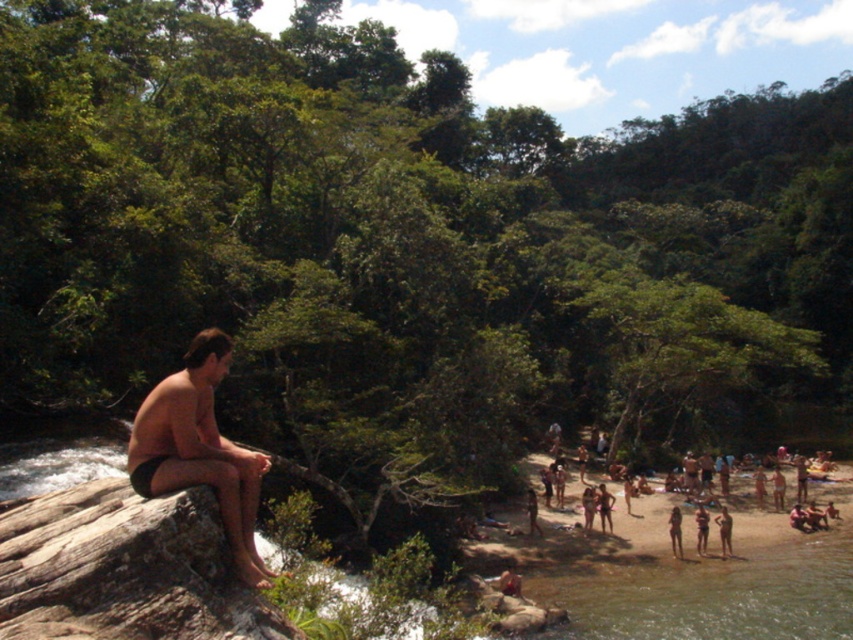
Question: In this image, where is matte black shorts at left located relative to tan skin human at lower right?

Choices:
 (A) right
 (B) left

Answer: (B)

Question: Which object appears closest to the camera in this image?

Choices:
 (A) matte black shorts at left
 (B) tan skin human at lower right

Answer: (A)

Question: Which of the following is the closest to the observer?

Choices:
 (A) tan skin human at lower right
 (B) matte black shorts at left

Answer: (B)

Question: Is matte black shorts at left below tan skin human at lower right?

Choices:
 (A) yes
 (B) no

Answer: (B)

Question: Which point is closer to the camera taking this photo?

Choices:
 (A) (170, 467)
 (B) (669, 515)

Answer: (A)

Question: Does matte black shorts at left appear over tan skin human at lower right?

Choices:
 (A) no
 (B) yes

Answer: (B)